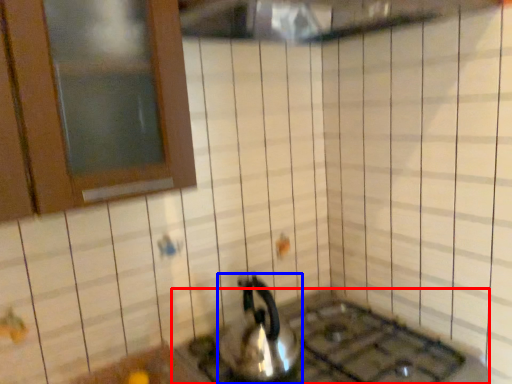
Question: Which of the following is the closest to the observer, gas stove (highlighted by a red box) or kettle (highlighted by a blue box)?

Choices:
 (A) gas stove
 (B) kettle

Answer: (A)